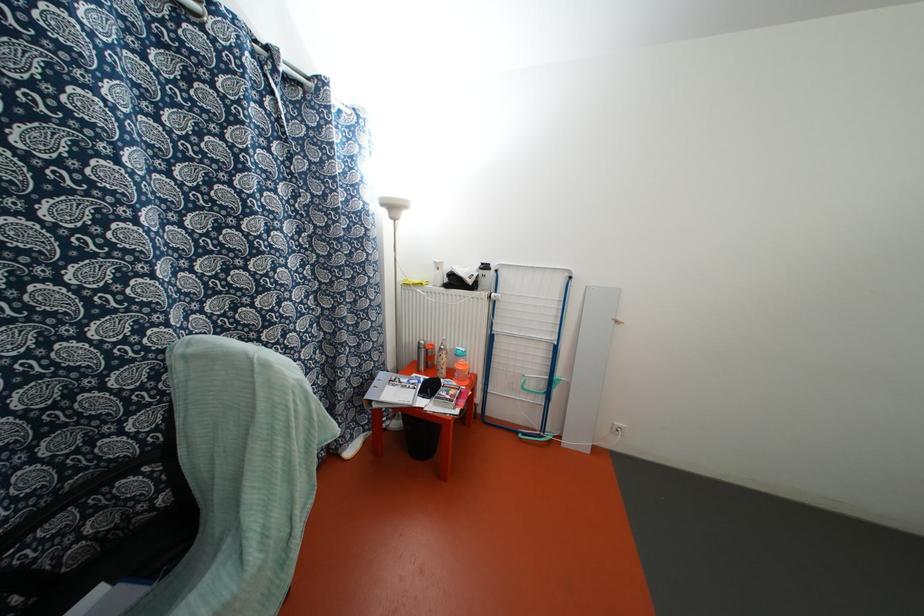
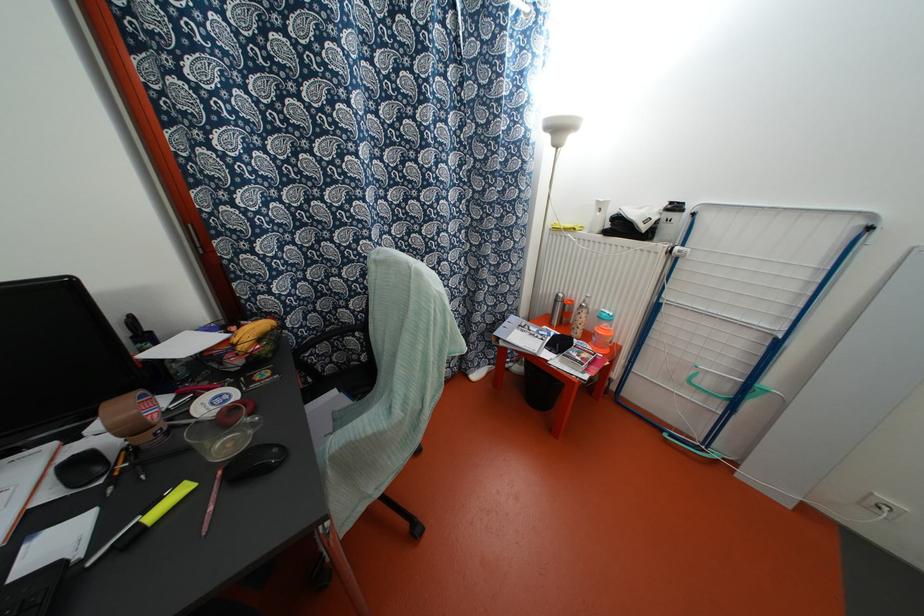
Locate, in the second image, the point that corresponds to [167,533] in the first image.

(362, 377)